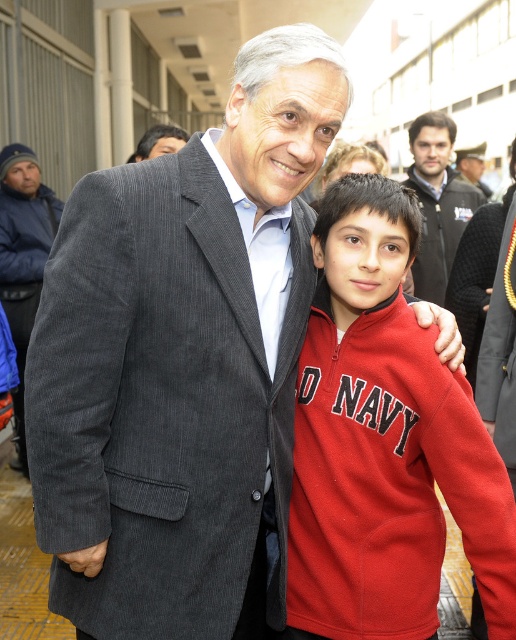
Question: In this image, where is red fleece jacket at right located relative to dark gray corduroy jacket at center?

Choices:
 (A) above
 (B) below

Answer: (B)

Question: Which object is positioned closest to the dark blue fleece sweatshirt at left?

Choices:
 (A) dark gray corduroy jacket at center
 (B) blue corduroy jacket at left
 (C) red fleece jacket at right

Answer: (B)

Question: Can you confirm if blue corduroy jacket at left is thinner than dark gray corduroy suit at center?

Choices:
 (A) no
 (B) yes

Answer: (A)

Question: Can you confirm if blue corduroy jacket at left is positioned below matte black uniform at upper right?

Choices:
 (A) no
 (B) yes

Answer: (B)

Question: Which of these objects is positioned closest to the blue corduroy jacket at left?

Choices:
 (A) dark gray corduroy suit at center
 (B) matte black uniform at upper right
 (C) red fleece jacket at right
 (D) dark blue fleece sweatshirt at left

Answer: (D)

Question: Among these points, which one is nearest to the camera?

Choices:
 (A) (446, 195)
 (B) (44, 195)
 (C) (143, 147)
 (D) (7, 232)

Answer: (C)